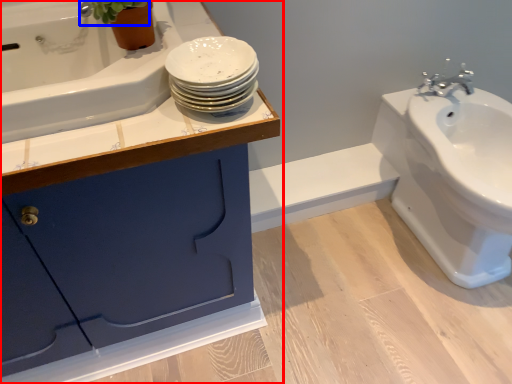
Question: Which object appears farthest to the camera in this image, bathroom cabinet (highlighted by a red box) or plant (highlighted by a blue box)?

Choices:
 (A) bathroom cabinet
 (B) plant

Answer: (B)